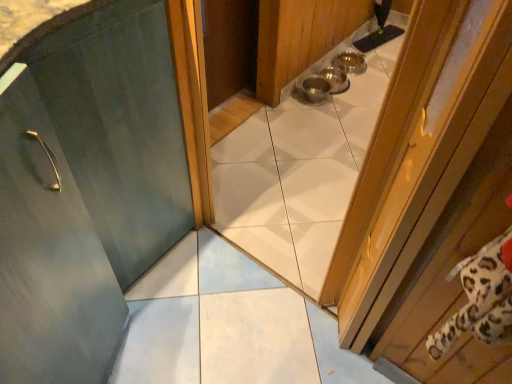
Where is `wooden door at right, the 1th door positioned from the right`? This screenshot has height=384, width=512. wooden door at right, the 1th door positioned from the right is located at coordinates (437, 193).

The image size is (512, 384). What do you see at coordinates (437, 193) in the screenshot? I see `wooden door at right, the 1th door positioned from the right` at bounding box center [437, 193].

Measure the distance between wooden door at right, the second door from the left, and camera.

A distance of 19.47 inches exists between wooden door at right, the second door from the left, and camera.

This screenshot has height=384, width=512. In order to click on matte green door at center, which appears as the 1th door when viewed from the left in this screenshot , I will do `click(86, 189)`.

The width and height of the screenshot is (512, 384). Describe the element at coordinates (86, 189) in the screenshot. I see `matte green door at center, which appears as the 1th door when viewed from the left` at that location.

You are a GUI agent. You are given a task and a screenshot of the screen. Output one action in this format:
    pyautogui.click(x=<x>, y=<y>)
    Task: Click on the wooden door at right, the second door from the left
    The image size is (512, 384).
    Given the screenshot: What is the action you would take?
    pyautogui.click(x=437, y=193)

Considering the relative positions of wooden door at right, the second door from the left, and matte green door at center, which appears as the 1th door when viewed from the left, in the image provided, is wooden door at right, the second door from the left, to the right of matte green door at center, which appears as the 1th door when viewed from the left, from the viewer's perspective?

Yes, wooden door at right, the second door from the left, is to the right of matte green door at center, which appears as the 1th door when viewed from the left.

Considering the relative positions of wooden door at right, the 1th door positioned from the right, and matte green door at center, which appears as the 1th door when viewed from the left, in the image provided, is wooden door at right, the 1th door positioned from the right, in front of matte green door at center, which appears as the 1th door when viewed from the left,?

Yes, wooden door at right, the 1th door positioned from the right, is in front of matte green door at center, which appears as the 1th door when viewed from the left.

Is point (423, 72) behind point (120, 117)?

No.

Based on the photo, from the image's perspective, which one is positioned lower, wooden door at right, the second door from the left, or matte green door at center, which appears as the 1th door when viewed from the left?

wooden door at right, the second door from the left.

From a real-world perspective, is wooden door at right, the second door from the left, physically located above or below matte green door at center, which is the 2th door from right to left?

In terms of real-world spatial position, wooden door at right, the second door from the left, is above matte green door at center, which is the 2th door from right to left.

Considering the relative sizes of wooden door at right, the 1th door positioned from the right, and matte green door at center, which appears as the 1th door when viewed from the left, in the image provided, is wooden door at right, the 1th door positioned from the right, thinner than matte green door at center, which appears as the 1th door when viewed from the left,?

Correct, the width of wooden door at right, the 1th door positioned from the right, is less than that of matte green door at center, which appears as the 1th door when viewed from the left.

In terms of height, does wooden door at right, the second door from the left, look taller or shorter compared to matte green door at center, which appears as the 1th door when viewed from the left?

Clearly, wooden door at right, the second door from the left, is shorter compared to matte green door at center, which appears as the 1th door when viewed from the left.

Can you confirm if wooden door at right, the 1th door positioned from the right, is bigger than matte green door at center, which appears as the 1th door when viewed from the left?

No, wooden door at right, the 1th door positioned from the right, is not bigger than matte green door at center, which appears as the 1th door when viewed from the left.

Is wooden door at right, the 1th door positioned from the right, inside or outside of matte green door at center, which appears as the 1th door when viewed from the left?

wooden door at right, the 1th door positioned from the right, exists outside the volume of matte green door at center, which appears as the 1th door when viewed from the left.

Is the surface of wooden door at right, the second door from the left, in direct contact with matte green door at center, which is the 2th door from right to left?

wooden door at right, the second door from the left, and matte green door at center, which is the 2th door from right to left, are not in contact.

Is wooden door at right, the 1th door positioned from the right, facing away from matte green door at center, which appears as the 1th door when viewed from the left?

No, matte green door at center, which appears as the 1th door when viewed from the left, is not at the back of wooden door at right, the 1th door positioned from the right.

How different are the orientations of wooden door at right, the 1th door positioned from the right, and matte green door at center, which appears as the 1th door when viewed from the left, in degrees?

They differ by 91.4 degrees in their facing directions.

In order to click on door on the left side of wooden door at right, the second door from the left in this screenshot , I will do `click(86, 189)`.

Considering the relative positions of matte green door at center, which is the 2th door from right to left, and wooden door at right, the 1th door positioned from the right, in the image provided, is matte green door at center, which is the 2th door from right to left, to the left of wooden door at right, the 1th door positioned from the right, from the viewer's perspective?

Yes.

Is matte green door at center, which is the 2th door from right to left, further to camera compared to wooden door at right, the second door from the left?

Yes, matte green door at center, which is the 2th door from right to left, is further from the camera.

Is point (68, 251) positioned behind point (484, 186)?

That is True.

From the image's perspective, which one is positioned lower, matte green door at center, which appears as the 1th door when viewed from the left, or wooden door at right, the 1th door positioned from the right?

wooden door at right, the 1th door positioned from the right.

From a real-world perspective, is matte green door at center, which appears as the 1th door when viewed from the left, positioned over wooden door at right, the 1th door positioned from the right, based on gravity?

No, from a real-world perspective, matte green door at center, which appears as the 1th door when viewed from the left, is not above wooden door at right, the 1th door positioned from the right.

Considering the relative sizes of matte green door at center, which appears as the 1th door when viewed from the left, and wooden door at right, the second door from the left, in the image provided, is matte green door at center, which appears as the 1th door when viewed from the left, wider than wooden door at right, the second door from the left,?

Correct, the width of matte green door at center, which appears as the 1th door when viewed from the left, exceeds that of wooden door at right, the second door from the left.

Between matte green door at center, which appears as the 1th door when viewed from the left, and wooden door at right, the 1th door positioned from the right, which one has more height?

With more height is matte green door at center, which appears as the 1th door when viewed from the left.

Between matte green door at center, which appears as the 1th door when viewed from the left, and wooden door at right, the second door from the left, which one has smaller size?

wooden door at right, the second door from the left.

Is matte green door at center, which appears as the 1th door when viewed from the left, located outside wooden door at right, the 1th door positioned from the right?

That's correct, matte green door at center, which appears as the 1th door when viewed from the left, is outside of wooden door at right, the 1th door positioned from the right.

Are matte green door at center, which appears as the 1th door when viewed from the left, and wooden door at right, the second door from the left, beside each other?

They are not placed beside each other.

Is matte green door at center, which appears as the 1th door when viewed from the left, looking in the opposite direction of wooden door at right, the second door from the left?

No, matte green door at center, which appears as the 1th door when viewed from the left, is not facing the opposite direction of wooden door at right, the second door from the left.

How many degrees apart are the facing directions of matte green door at center, which is the 2th door from right to left, and wooden door at right, the 1th door positioned from the right?

91.4 degrees separate the facing orientations of matte green door at center, which is the 2th door from right to left, and wooden door at right, the 1th door positioned from the right.

Locate an element on the screen. The width and height of the screenshot is (512, 384). door below the matte green door at center, which is the 2th door from right to left (from the image's perspective) is located at coordinates (437, 193).

Identify the location of door below the wooden door at right, the 1th door positioned from the right (from a real-world perspective). (86, 189).

Identify the location of door on the right of matte green door at center, which is the 2th door from right to left. The image size is (512, 384). (437, 193).